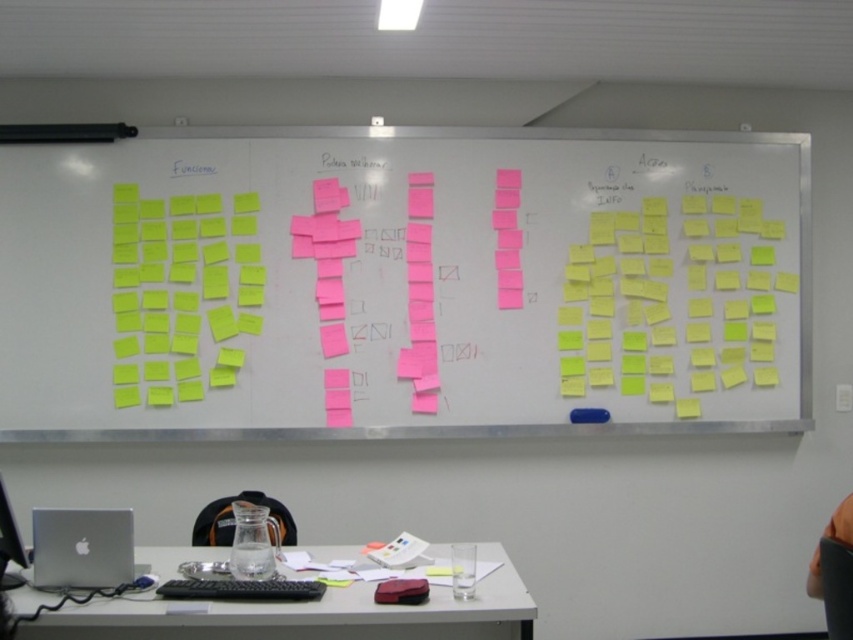
Question: Can you confirm if yellow sticky notes at center is bigger than silver metallic computer at lower left?

Choices:
 (A) no
 (B) yes

Answer: (B)

Question: Which point is farther to the camera?

Choices:
 (A) (90, 572)
 (B) (96, 600)
 (C) (0, 502)
 (D) (514, 339)

Answer: (D)

Question: Which object is farther from the camera taking this photo?

Choices:
 (A) yellow sticky notes at center
 (B) silver metallic laptop at lower left
 (C) white plastic table at lower center

Answer: (A)

Question: Which object is closer to the camera taking this photo?

Choices:
 (A) silver metallic laptop at lower left
 (B) white plastic table at lower center
 (C) silver metallic computer at lower left
 (D) yellow sticky notes at center

Answer: (B)

Question: Can you confirm if silver metallic laptop at lower left is smaller than silver metallic computer at lower left?

Choices:
 (A) yes
 (B) no

Answer: (B)

Question: Observing the image, what is the correct spatial positioning of silver metallic laptop at lower left in reference to silver metallic computer at lower left?

Choices:
 (A) left
 (B) right

Answer: (B)